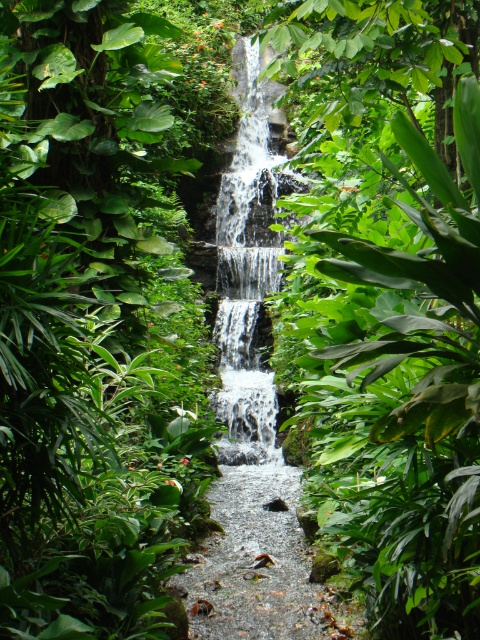
Who is taller, smooth gravel path at center or white frothy water at center?

white frothy water at center

Is smooth gravel path at center smaller than white frothy water at center?

Yes.

Between point (226, 532) and point (243, 444), which one is positioned in front?

Point (226, 532) is in front.

Find the location of `smooth gravel path at center`. smooth gravel path at center is located at coordinates (259, 564).